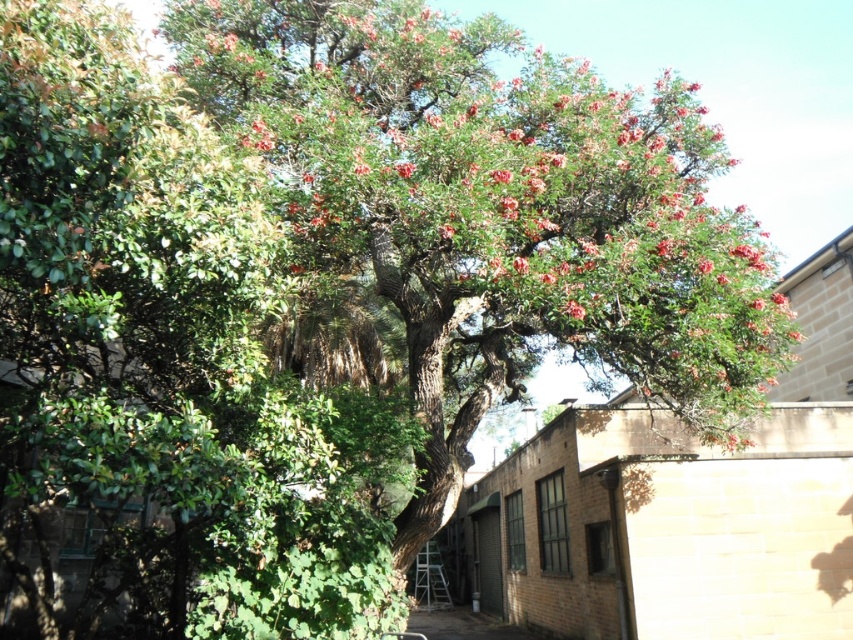
Question: Which point appears farthest from the camera in this image?

Choices:
 (A) (248, 588)
 (B) (776, 340)

Answer: (B)

Question: Can you confirm if green leafy tree at upper left is smaller than green leafy tree at center?

Choices:
 (A) yes
 (B) no

Answer: (B)

Question: Can you confirm if green leafy tree at upper left is positioned below green leafy tree at center?

Choices:
 (A) yes
 (B) no

Answer: (B)

Question: Which point is closer to the camera?

Choices:
 (A) green leafy tree at upper left
 (B) green leafy tree at center

Answer: (A)

Question: Can you confirm if green leafy tree at upper left is positioned below green leafy tree at center?

Choices:
 (A) no
 (B) yes

Answer: (A)